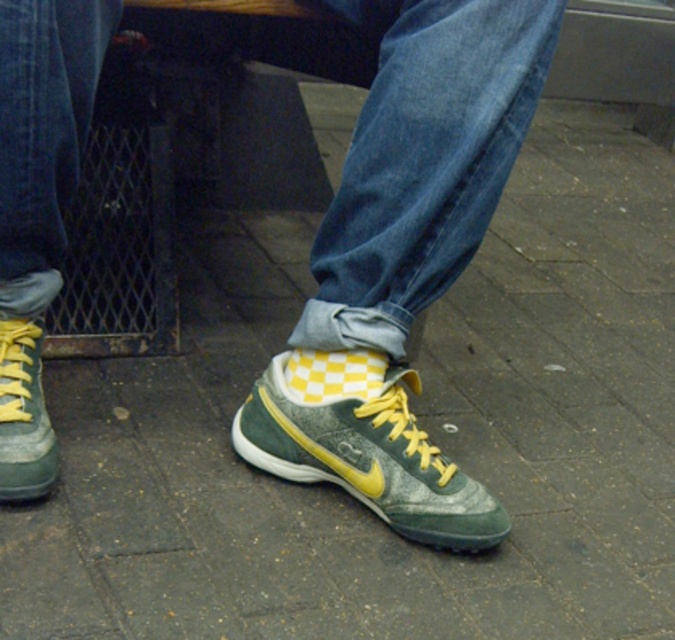
This screenshot has height=640, width=675. What do you see at coordinates (402, 259) in the screenshot?
I see `green textured sneakers at center` at bounding box center [402, 259].

Can you confirm if green textured sneakers at center is positioned below green suede sneaker at center?

No.

Who is more forward, (20, 13) or (452, 493)?

Point (20, 13)

Identify the location of green textured sneakers at center. This screenshot has height=640, width=675. (402, 259).

Between point (300, 429) and point (9, 288), which one is positioned in front?

Point (9, 288)

Is green suede sneaker at center taller than green suede shoe at lower left?

No.

Who is more forward, (277, 429) or (30, 378)?

Point (30, 378) is more forward.

This screenshot has height=640, width=675. In order to click on green suede sneaker at center in this screenshot , I will do `click(367, 452)`.

Measure the distance between point (30, 234) and camera.

Point (30, 234) and camera are 33.00 inches apart.

Is green textured sneakers at center behind green suede shoe at lower left?

No, it is not.

The height and width of the screenshot is (640, 675). I want to click on green textured sneakers at center, so click(x=402, y=259).

The width and height of the screenshot is (675, 640). In order to click on green textured sneakers at center in this screenshot , I will do `click(402, 259)`.